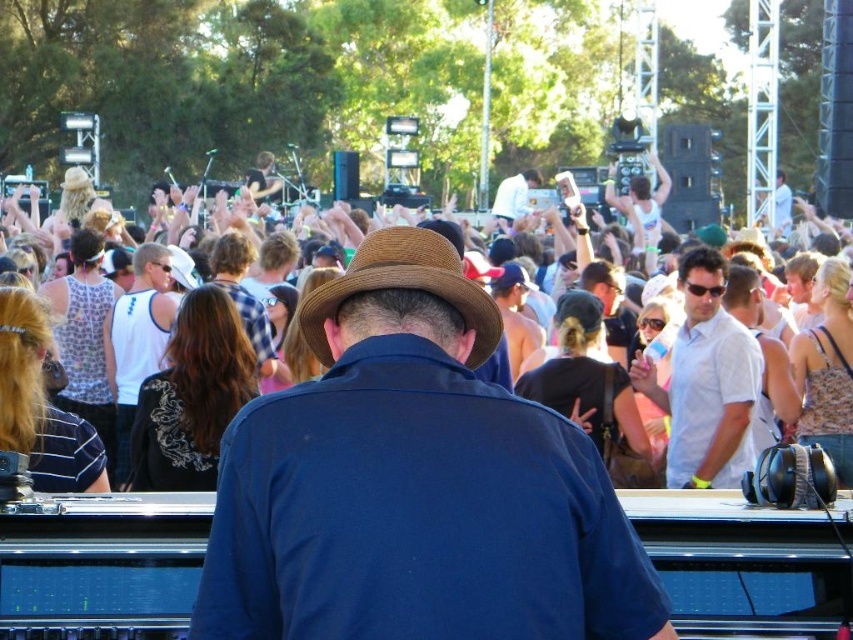
Question: Which point is closer to the camera taking this photo?

Choices:
 (A) (695, 278)
 (B) (160, 256)
 (C) (113, 394)

Answer: (A)

Question: Does white cotton shirt at center appear over brown hat at center?

Choices:
 (A) no
 (B) yes

Answer: (A)

Question: Can you confirm if white cotton shirt at center is thinner than brown felt fedora at center?

Choices:
 (A) no
 (B) yes

Answer: (B)

Question: Does brown felt fedora at center have a greater width compared to white tank top at center?

Choices:
 (A) no
 (B) yes

Answer: (B)

Question: Which of the following is the farthest from the observer?

Choices:
 (A) brown felt fedora at center
 (B) white cotton shirt at center
 (C) white tank top at center
 (D) matte brown hat at center

Answer: (C)

Question: Which of the following is the farthest from the observer?

Choices:
 (A) brown felt fedora at center
 (B) white cotton shirt at center

Answer: (B)